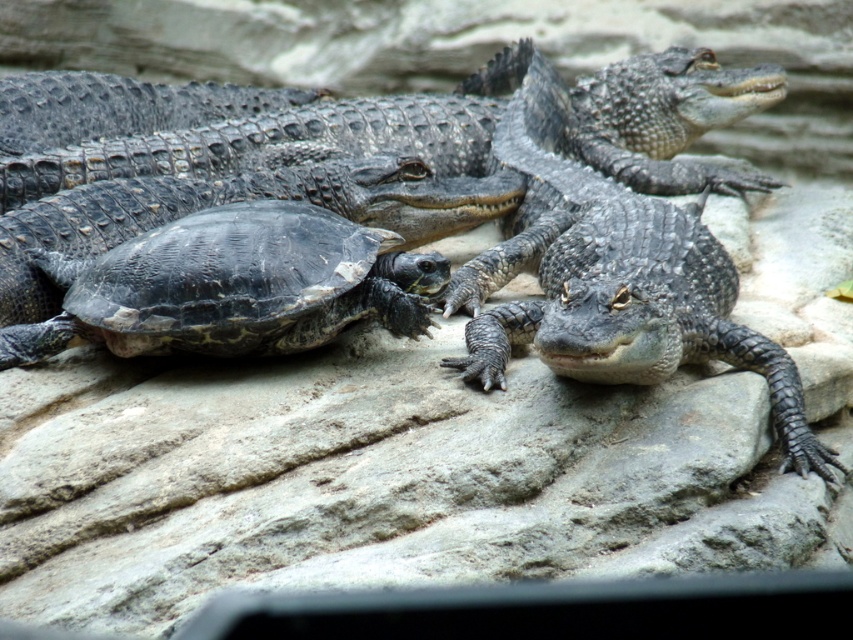
You are a photographer trying to capture a clear shot of the shiny dark green crocodile at center and the black textured shell at lower left. Which object should you focus on first if you want to ensure both are in focus without adjusting the camera settings?

The shiny dark green crocodile at center is taller than the black textured shell at lower left. To ensure both are in focus, you should focus on the shiny dark green crocodile at center first since it is closer to the camera and has a larger size, which requires adjusting the focus point to accommodate its height and proximity.

You are a wildlife photographer aiming to capture a clear photo of both the shiny dark green crocodile at center and the shiny black alligator at center. Since you want to focus on the crocodile first, which one should you adjust your camera focus on first to ensure it appears sharp in the photo?

The shiny dark green crocodile at center is larger in size compared to the shiny black alligator at center, so you should adjust your camera focus on the shiny dark green crocodile at center first to ensure it appears sharp in the photo.